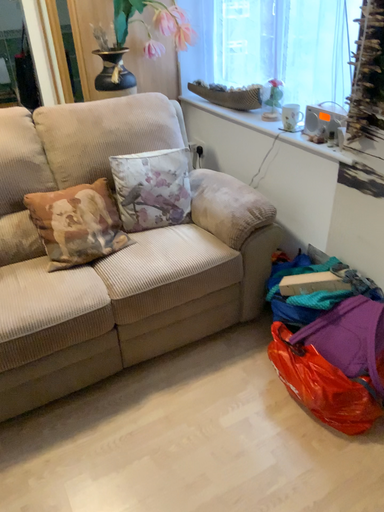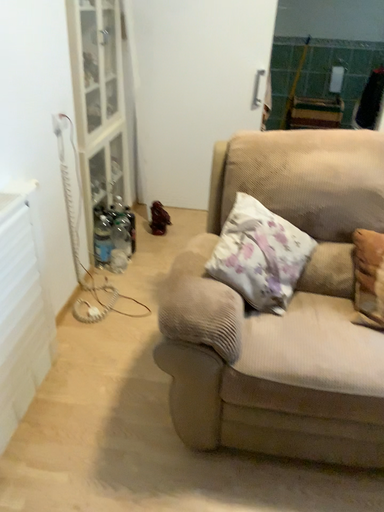
Question: How did the camera likely rotate when shooting the video?

Choices:
 (A) rotated left
 (B) rotated right

Answer: (A)